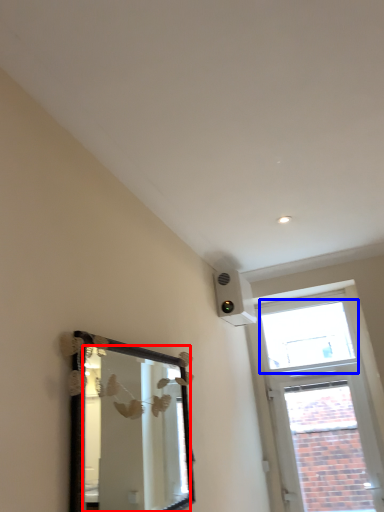
Question: Which object is further to the camera taking this photo, mirror (highlighted by a red box) or window (highlighted by a blue box)?

Choices:
 (A) mirror
 (B) window

Answer: (B)